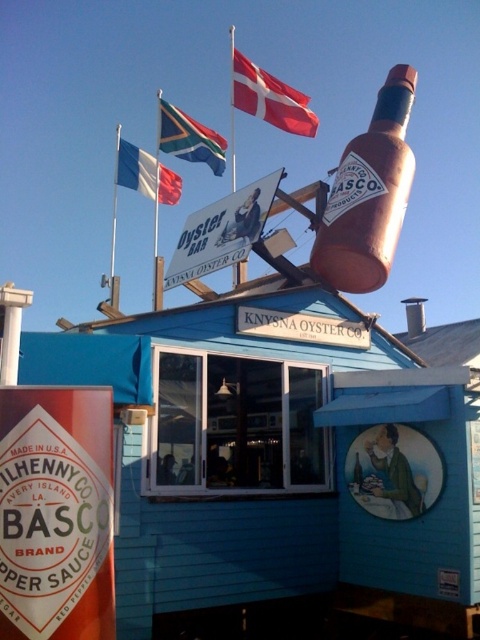
Based on the photo, does blue wooden hut at center have a larger size compared to red fabric flag at upper center?

No, blue wooden hut at center is not bigger than red fabric flag at upper center.

Between point (365, 520) and point (252, 65), which one is positioned behind?

The point (252, 65) is more distant.

At what (x,y) coordinates should I click in order to perform the action: click on blue wooden hut at center. Please return your answer as a coordinate pair (x, y). This screenshot has height=640, width=480. Looking at the image, I should click on (283, 458).

Is point (381, 400) positioned before point (128, 176)?

Yes, it is in front of point (128, 176).

Between point (136, 532) and point (166, 172), which one is positioned behind?

Positioned behind is point (166, 172).

The width and height of the screenshot is (480, 640). Find the location of `blue wooden hut at center`. blue wooden hut at center is located at coordinates (283, 458).

Which is below, south african flag at upper center or white fabric flag at upper left?

white fabric flag at upper left

Is point (212, 164) farther from camera compared to point (146, 182)?

No, (212, 164) is closer to viewer.

Identify the location of south african flag at upper center. (190, 138).